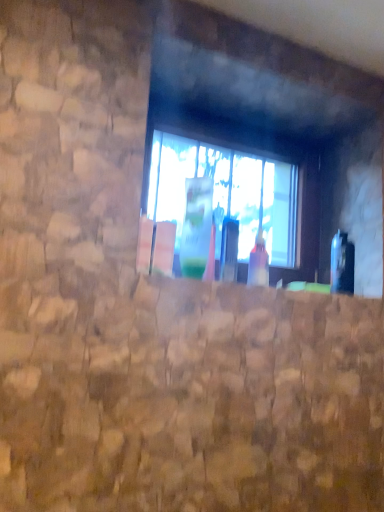
From the picture: Measure the distance between transparent glass window at center and camera.

The depth of transparent glass window at center is 3.71 feet.

The height and width of the screenshot is (512, 384). What do you see at coordinates (241, 189) in the screenshot?
I see `transparent glass window at center` at bounding box center [241, 189].

You are a GUI agent. You are given a task and a screenshot of the screen. Output one action in this format:
    pyautogui.click(x=<x>, y=<y>)
    Task: Click on the transparent glass window at center
    The height and width of the screenshot is (512, 384).
    Given the screenshot: What is the action you would take?
    pyautogui.click(x=241, y=189)

Where is `transparent glass window at center`? The width and height of the screenshot is (384, 512). transparent glass window at center is located at coordinates (241, 189).